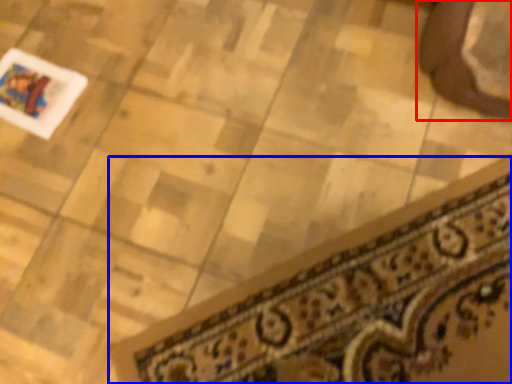
Question: Which object is closer to the camera taking this photo, footwear (highlighted by a red box) or doormat (highlighted by a blue box)?

Choices:
 (A) footwear
 (B) doormat

Answer: (B)